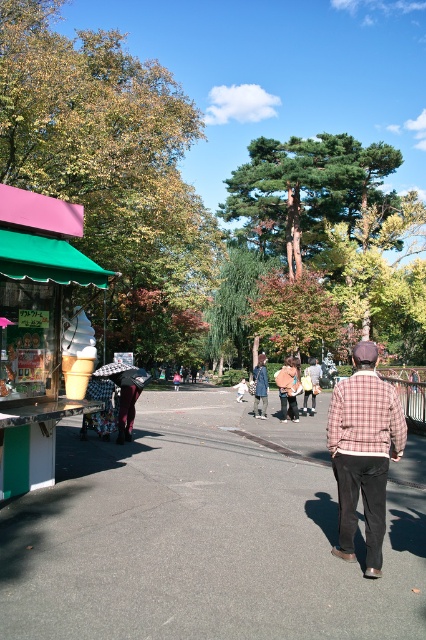
Which is below, green leafy tree at upper left or denim jacket at center?

denim jacket at center

Does green leafy tree at upper left have a lesser height compared to denim jacket at center?

Incorrect, green leafy tree at upper left's height does not fall short of denim jacket at center's.

Does point (80, 51) lie in front of point (261, 380)?

No, (80, 51) is behind (261, 380).

You are a GUI agent. You are given a task and a screenshot of the screen. Output one action in this format:
    pyautogui.click(x=<x>, y=<y>)
    Task: Click on the green leafy tree at upper left
    The height and width of the screenshot is (640, 426).
    Given the screenshot: What is the action you would take?
    pyautogui.click(x=112, y=170)

Is autumn leaves at center further to the viewer compared to plaid shirt at center?

That is True.

The width and height of the screenshot is (426, 640). What do you see at coordinates (291, 312) in the screenshot? I see `autumn leaves at center` at bounding box center [291, 312].

Is point (253, 333) positioned after point (305, 394)?

That is True.

You are a GUI agent. You are given a task and a screenshot of the screen. Output one action in this format:
    pyautogui.click(x=<x>, y=<y>)
    Task: Click on the autumn leaves at center
    
    Given the screenshot: What is the action you would take?
    pyautogui.click(x=291, y=312)

Does green leafy tree at upper left have a smaller size compared to plaid shirt at center?

Actually, green leafy tree at upper left might be larger than plaid shirt at center.

Which is behind, point (46, 138) or point (307, 372)?

Positioned behind is point (46, 138).

Where is `green leafy tree at upper left`? The image size is (426, 640). green leafy tree at upper left is located at coordinates (112, 170).